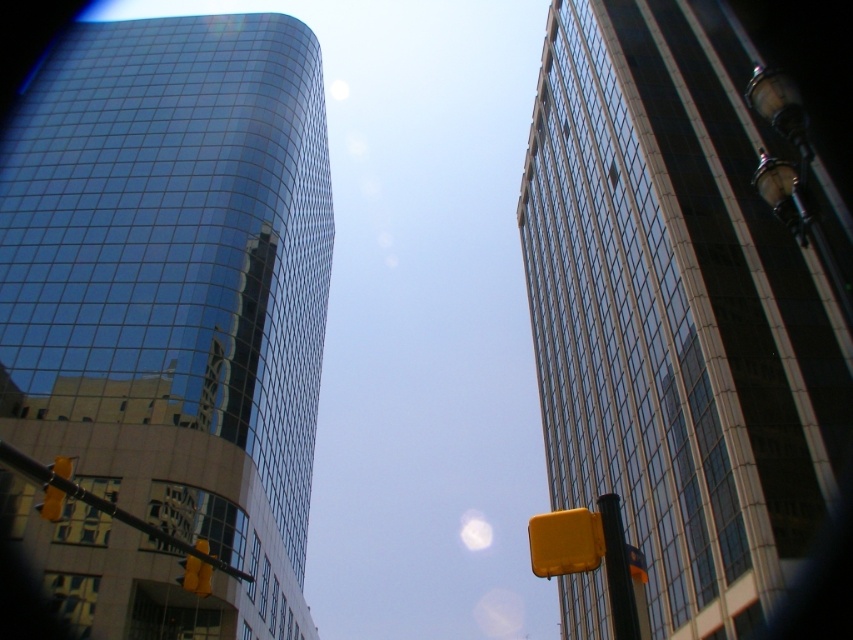
You are a delivery driver approaching an intersection in the city. You see a yellow matte traffic light at lower left. Is there any other object at the point marked by coordinates (195, 576) besides the yellow matte traffic light at lower left?

The point (195, 576) is occupied by the yellow matte traffic light at lower left, so there are no other objects at that location.

You are standing at the center of the image and want to place a new decorative flag exactly where the yellow plastic pole at lower left is located. What are the coordinates where you should place the flag?

The coordinates for placing the flag should be at point (102, 504), which is where the yellow plastic pole at lower left is located.